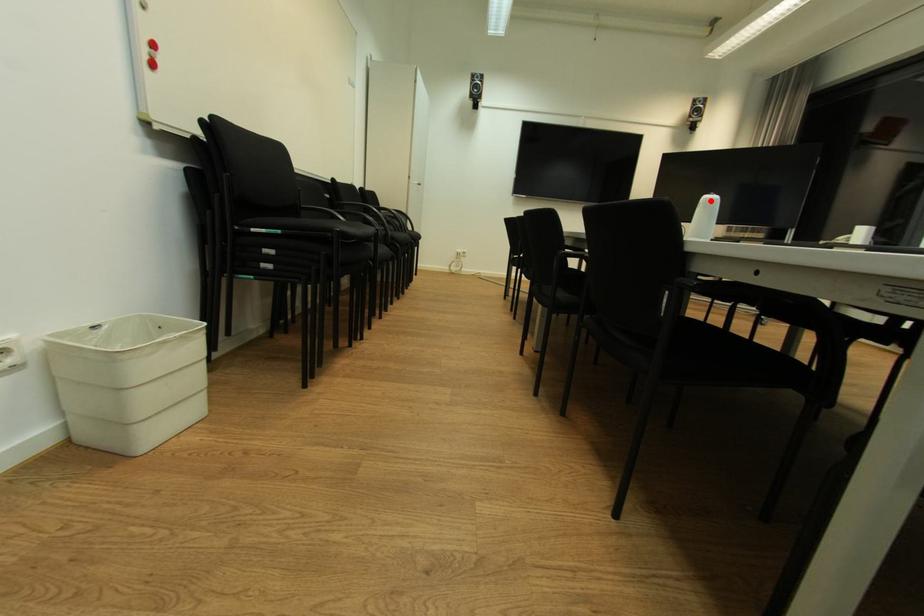
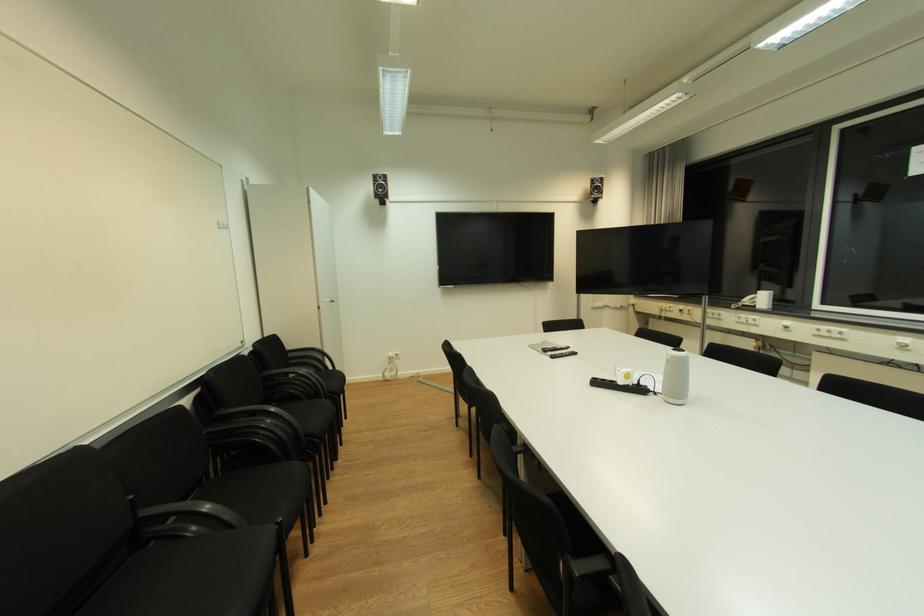
In the second image, find the point that corresponds to the highlighted location in the first image.

(678, 358)